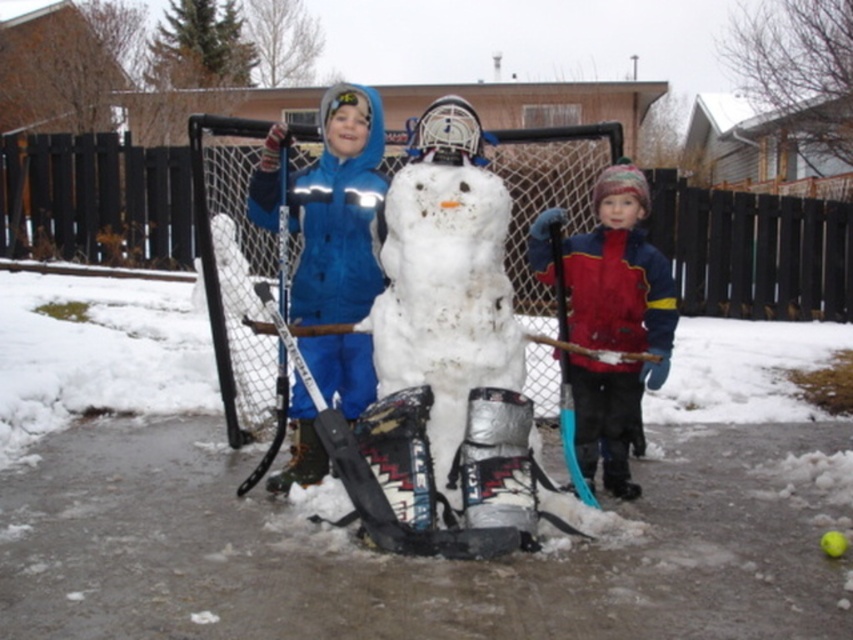
Who is more distant from viewer, (787,532) or (555,250)?

Positioned behind is point (555,250).

Is white fluffy snow at center to the right of blue plastic hockey stick at right from the viewer's perspective?

In fact, white fluffy snow at center is to the left of blue plastic hockey stick at right.

The image size is (853, 640). Describe the element at coordinates (347, 502) in the screenshot. I see `white fluffy snow at center` at that location.

In order to click on white fluffy snow at center in this screenshot , I will do `click(347, 502)`.

Find the location of a particular element. This screenshot has width=853, height=640. blue fabric snowman at center is located at coordinates (339, 211).

Is blue fabric snowman at center to the right of blue plastic hockey stick at right from the viewer's perspective?

No, blue fabric snowman at center is not to the right of blue plastic hockey stick at right.

Is point (312, 408) positioned behind point (560, 401)?

Yes, it is behind point (560, 401).

This screenshot has width=853, height=640. I want to click on blue fabric snowman at center, so click(x=339, y=211).

Does red fleece jacket at right appear under blue plastic hockey stick at right?

Actually, red fleece jacket at right is above blue plastic hockey stick at right.

Is point (592, 339) less distant than point (566, 314)?

That is False.

Image resolution: width=853 pixels, height=640 pixels. I want to click on red fleece jacket at right, so click(x=614, y=323).